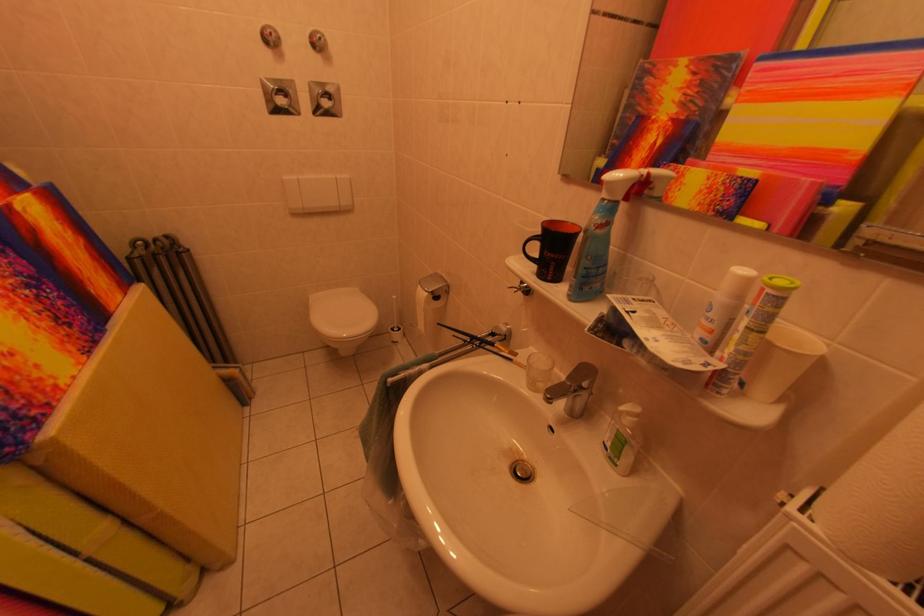
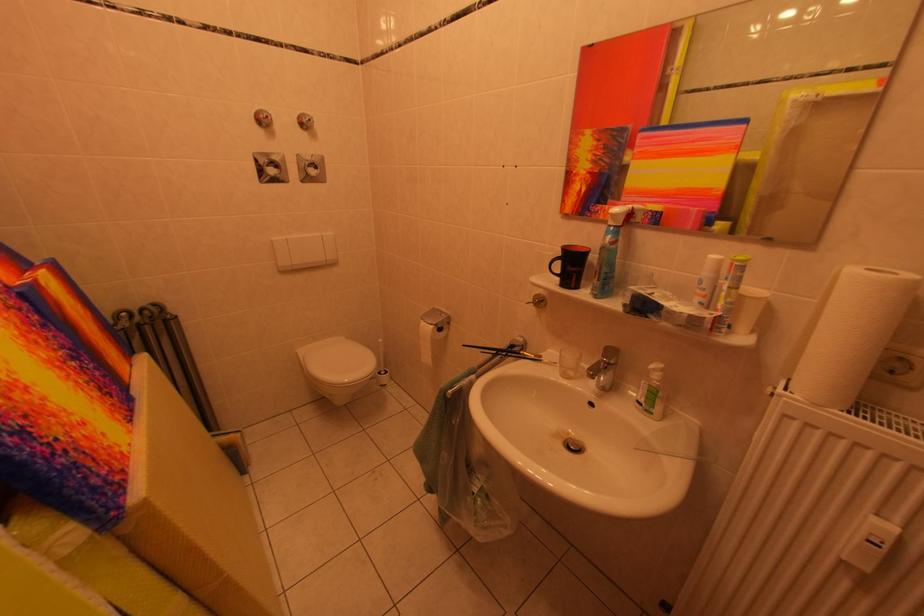
In the second image, find the point that corresponds to (402,333) in the first image.

(388, 378)